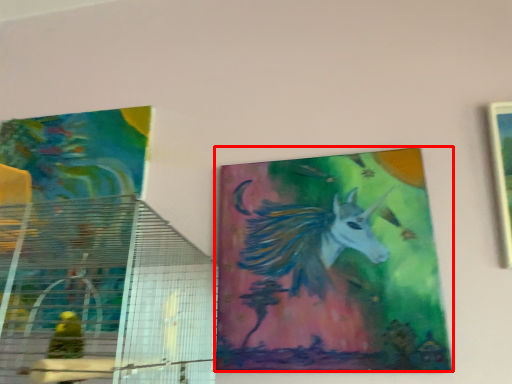
Question: From the image's perspective, where is picture frame (annotated by the red box) located in relation to picture frame in the image?

Choices:
 (A) above
 (B) below

Answer: (B)